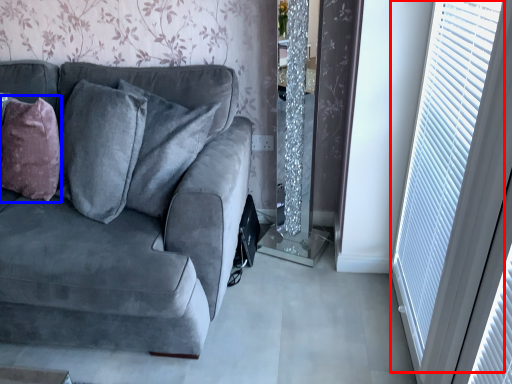
Question: Among these objects, which one is nearest to the camera, window (highlighted by a red box) or throw pillow (highlighted by a blue box)?

Choices:
 (A) window
 (B) throw pillow

Answer: (A)